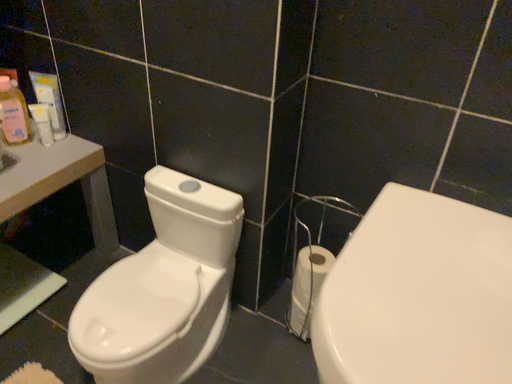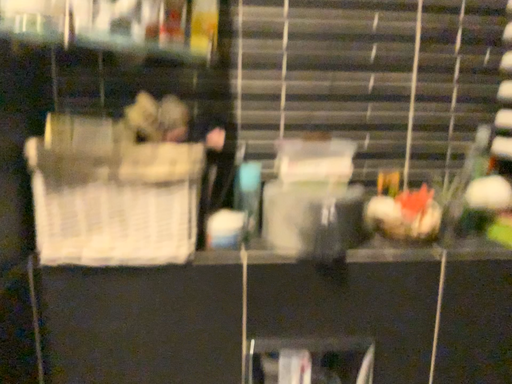
Question: Which way did the camera rotate in the video?

Choices:
 (A) rotated upward
 (B) rotated downward

Answer: (A)